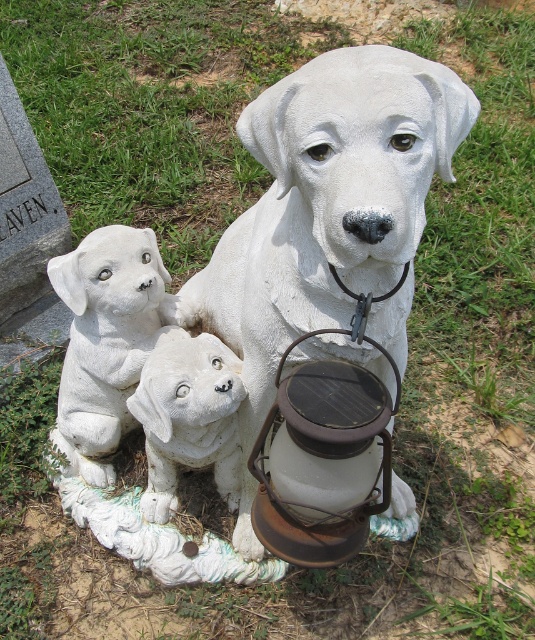
Is white stone dog at center smaller than white stone puppies at lower left?

No, white stone dog at center is not smaller than white stone puppies at lower left.

Does point (299, 250) lie behind point (75, 276)?

No, (299, 250) is closer to viewer.

Where is `white stone dog at center`? white stone dog at center is located at coordinates (328, 209).

Does white stone dog at center have a smaller size compared to white matte dog at center?

No.

Which is more to the right, white stone dog at center or white matte dog at center?

white stone dog at center is more to the right.

Where is `white stone dog at center`? white stone dog at center is located at coordinates (328, 209).

Describe the element at coordinates (323, 460) in the screenshot. I see `rusty metal lantern at center` at that location.

Can you confirm if rusty metal lantern at center is shorter than white matte dog at center?

Correct, rusty metal lantern at center is not as tall as white matte dog at center.

Does point (294, 445) come in front of point (172, 426)?

Yes, it is in front of point (172, 426).

Where is `rusty metal lantern at center`? rusty metal lantern at center is located at coordinates (323, 460).